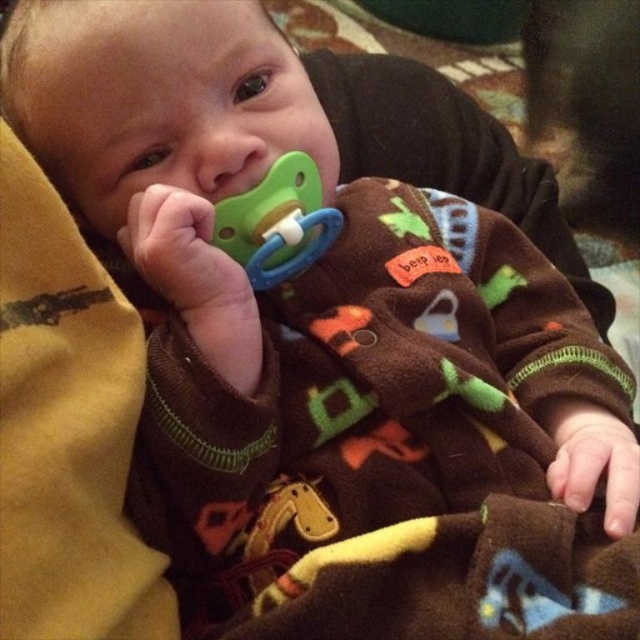
Question: Is the position of brown fleece blanket at lower center more distant than that of green rubber pacifier at center?

Choices:
 (A) no
 (B) yes

Answer: (A)

Question: Among these objects, which one is nearest to the camera?

Choices:
 (A) brown fleece blanket at lower center
 (B) green rubber pacifier at center

Answer: (A)

Question: Among these objects, which one is nearest to the camera?

Choices:
 (A) green rubber pacifier at center
 (B) brown fleece blanket at lower center

Answer: (B)

Question: Is brown fleece blanket at lower center closer to the viewer compared to green rubber pacifier at center?

Choices:
 (A) yes
 (B) no

Answer: (A)

Question: Is brown fleece blanket at lower center to the right of green rubber pacifier at center from the viewer's perspective?

Choices:
 (A) yes
 (B) no

Answer: (A)